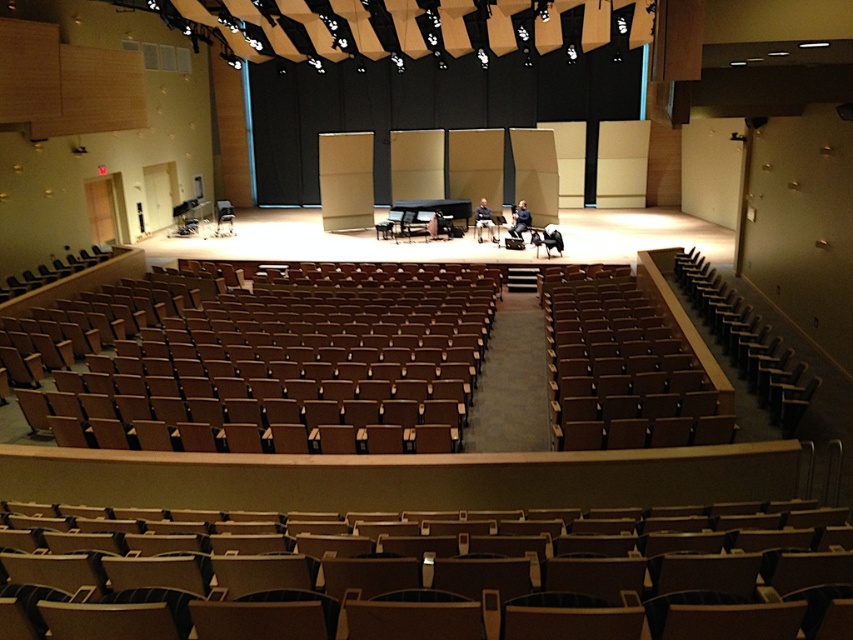
Question: Is wooden seat at center to the right of brown leather chair at right from the viewer's perspective?

Choices:
 (A) yes
 (B) no

Answer: (B)

Question: Which point appears farthest from the camera in this image?

Choices:
 (A) click(x=67, y=538)
 (B) click(x=700, y=316)

Answer: (B)

Question: Can you confirm if wooden seat at center is positioned to the right of brown leather chair at right?

Choices:
 (A) yes
 (B) no

Answer: (B)

Question: Is wooden seat at center to the right of brown leather chair at right from the viewer's perspective?

Choices:
 (A) yes
 (B) no

Answer: (B)

Question: Which point appears farthest from the camera in this image?

Choices:
 (A) (624, 381)
 (B) (35, 592)
 (C) (700, 268)

Answer: (C)

Question: Which point is closer to the camera taking this photo?

Choices:
 (A) (733, 358)
 (B) (497, 554)
 (C) (567, 394)

Answer: (B)